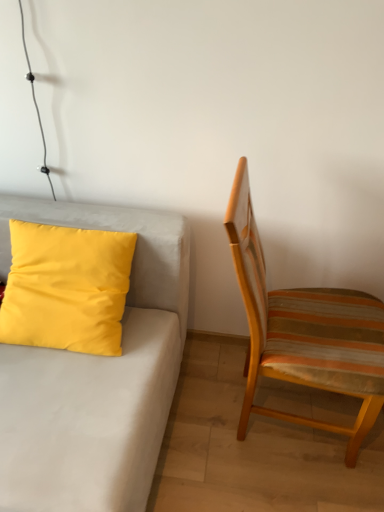
Question: Does matte yellow pillow at upper left have a smaller size compared to yellow matte pillow at left?

Choices:
 (A) yes
 (B) no

Answer: (B)

Question: Is matte yellow pillow at upper left at the left side of yellow matte pillow at left?

Choices:
 (A) yes
 (B) no

Answer: (A)

Question: Is matte yellow pillow at upper left positioned before yellow matte pillow at left?

Choices:
 (A) yes
 (B) no

Answer: (A)

Question: Is matte yellow pillow at upper left not within yellow matte pillow at left?

Choices:
 (A) yes
 (B) no

Answer: (A)

Question: Considering the relative sizes of matte yellow pillow at upper left and yellow matte pillow at left in the image provided, is matte yellow pillow at upper left wider than yellow matte pillow at left?

Choices:
 (A) no
 (B) yes

Answer: (B)

Question: From a real-world perspective, does matte yellow pillow at upper left sit lower than yellow matte pillow at left?

Choices:
 (A) no
 (B) yes

Answer: (B)

Question: Is striped fabric chair at right not inside yellow matte pillow at left?

Choices:
 (A) no
 (B) yes

Answer: (B)

Question: From a real-world perspective, is striped fabric chair at right physically above yellow matte pillow at left?

Choices:
 (A) yes
 (B) no

Answer: (B)

Question: Is striped fabric chair at right oriented away from yellow matte pillow at left?

Choices:
 (A) no
 (B) yes

Answer: (B)

Question: Would you consider striped fabric chair at right to be distant from yellow matte pillow at left?

Choices:
 (A) yes
 (B) no

Answer: (B)

Question: Does striped fabric chair at right have a smaller size compared to yellow matte pillow at left?

Choices:
 (A) yes
 (B) no

Answer: (B)

Question: Is striped fabric chair at right facing towards yellow matte pillow at left?

Choices:
 (A) yes
 (B) no

Answer: (B)

Question: Is the position of yellow matte pillow at left less distant than that of matte yellow pillow at upper left?

Choices:
 (A) no
 (B) yes

Answer: (A)